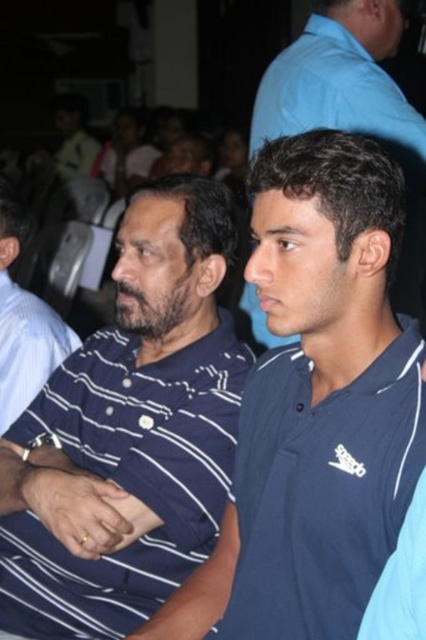
Between dark blue striped polo shirt at center and blue smooth shirt at center, which one appears on the right side from the viewer's perspective?

blue smooth shirt at center

Between dark blue striped polo shirt at center and blue smooth shirt at center, which one has less height?

blue smooth shirt at center is shorter.

I want to click on dark blue striped polo shirt at center, so click(129, 433).

Is navy blue/soft cotton polo shirt at center above blue smooth shirt at center?

No.

Who is higher up, navy blue/soft cotton polo shirt at center or blue smooth shirt at center?

blue smooth shirt at center is higher up.

Is point (386, 492) behind point (284, 116)?

No, (386, 492) is closer to viewer.

This screenshot has width=426, height=640. I want to click on navy blue/soft cotton polo shirt at center, so click(x=322, y=490).

Is point (62, 419) positioned behind point (279, 579)?

Yes, it is.

Which is behind, point (112, 570) or point (238, 484)?

Point (112, 570)

Who is more forward, (137,298) or (236,637)?

Point (236,637)

I want to click on dark blue striped polo shirt at center, so [x=129, y=433].